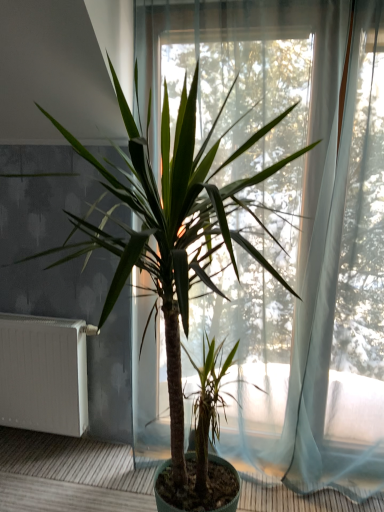
Question: From a real-world perspective, is transparent curtain at center physically above white matte radiator at left?

Choices:
 (A) no
 (B) yes

Answer: (B)

Question: Is transparent curtain at center aimed at white matte radiator at left?

Choices:
 (A) yes
 (B) no

Answer: (B)

Question: Is transparent curtain at center not inside white matte radiator at left?

Choices:
 (A) no
 (B) yes

Answer: (B)

Question: Does transparent curtain at center appear on the left side of white matte radiator at left?

Choices:
 (A) yes
 (B) no

Answer: (B)

Question: Can you confirm if transparent curtain at center is positioned to the right of white matte radiator at left?

Choices:
 (A) no
 (B) yes

Answer: (B)

Question: Does transparent curtain at center have a larger size compared to white matte radiator at left?

Choices:
 (A) no
 (B) yes

Answer: (B)

Question: From a real-world perspective, does white matte radiator at left stand above transparent curtain at center?

Choices:
 (A) yes
 (B) no

Answer: (B)

Question: Is white matte radiator at left looking in the opposite direction of transparent curtain at center?

Choices:
 (A) yes
 (B) no

Answer: (B)

Question: Can we say white matte radiator at left lies outside transparent curtain at center?

Choices:
 (A) yes
 (B) no

Answer: (A)

Question: From a real-world perspective, is white matte radiator at left under transparent curtain at center?

Choices:
 (A) no
 (B) yes

Answer: (B)

Question: Considering the relative sizes of white matte radiator at left and transparent curtain at center in the image provided, is white matte radiator at left shorter than transparent curtain at center?

Choices:
 (A) yes
 (B) no

Answer: (A)

Question: Is white matte radiator at left further to camera compared to transparent curtain at center?

Choices:
 (A) no
 (B) yes

Answer: (B)

Question: In terms of size, does white matte radiator at left appear bigger or smaller than transparent curtain at center?

Choices:
 (A) big
 (B) small

Answer: (B)